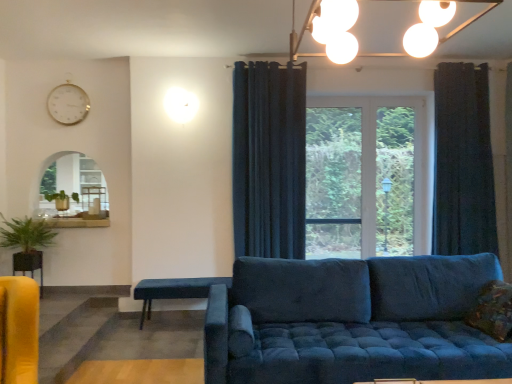
This screenshot has height=384, width=512. What do you see at coordinates (463, 162) in the screenshot?
I see `dark blue textured curtain at right, which appears as the first curtain when viewed from the right` at bounding box center [463, 162].

The width and height of the screenshot is (512, 384). Find the location of `velvet blue studio couch at center`. velvet blue studio couch at center is located at coordinates (351, 321).

Find the location of a particular element. matte white table at left, which is the second table from right to left is located at coordinates (93, 196).

This screenshot has width=512, height=384. In order to click on matte yellow table at lower left, the second table when ordered from front to back in this screenshot , I will do point(29,264).

What is the approximate width of matte yellow table at lower left, acting as the second table starting from the back?

matte yellow table at lower left, acting as the second table starting from the back, is 9.74 inches wide.

Measure the distance between point (x=36, y=237) and camera.

The distance of point (x=36, y=237) from camera is 4.28 meters.

This screenshot has height=384, width=512. I want to click on dark blue textured curtain at right, which ranks as the 2th curtain in left-to-right order, so click(463, 162).

Which is more to the left, white glossy clock at upper left or matte blue bench at center, acting as the first table starting from the bottom?

white glossy clock at upper left is more to the left.

Considering the sizes of objects white glossy clock at upper left and matte blue bench at center, the first table when ordered from front to back, in the image provided, who is bigger, white glossy clock at upper left or matte blue bench at center, the first table when ordered from front to back,?

matte blue bench at center, the first table when ordered from front to back, is bigger.

Between matte white table at left, the 3th table in the bottom-to-top sequence, and green leafy plant at left, which one has larger size?

green leafy plant at left is bigger.

From a real-world perspective, does matte white table at left, which is the second table from right to left, sit lower than green leafy plant at left?

Actually, matte white table at left, which is the second table from right to left, is physically above green leafy plant at left in the real world.

Which of these two, matte white table at left, the third table from the front, or green leafy plant at left, stands taller?

matte white table at left, the third table from the front.

Is matte white table at left, the 1th table when ordered from back to front, aimed at green leafy plant at left?

No, matte white table at left, the 1th table when ordered from back to front, does not turn towards green leafy plant at left.

Who is bigger, matte white table at left, the 1th table from the top, or white glossy clock at upper left?

Bigger between the two is white glossy clock at upper left.

Is point (85, 194) closer or farther from the camera than point (58, 88)?

Point (85, 194) is positioned closer to the camera compared to point (58, 88).

From a real-world perspective, between matte white table at left, the 1th table from the top, and white glossy clock at upper left, who is vertically higher?

In real-world perspective, white glossy clock at upper left is above.

Based on the photo, is matte white table at left, the 1th table when ordered from back to front, next to white glossy clock at upper left?

No, matte white table at left, the 1th table when ordered from back to front, is not next to white glossy clock at upper left.

From the image's perspective, is white glossy clock at upper left under matte yellow table at lower left, the 2th table viewed from the top?

No, from the image's perspective, white glossy clock at upper left is not below matte yellow table at lower left, the 2th table viewed from the top.

Is white glossy clock at upper left at the right side of matte yellow table at lower left, acting as the second table starting from the back?

Indeed, white glossy clock at upper left is positioned on the right side of matte yellow table at lower left, acting as the second table starting from the back.

Which object is closer to the camera, white glossy clock at upper left or matte yellow table at lower left, acting as the second table starting from the back?

matte yellow table at lower left, acting as the second table starting from the back.

From the image's perspective, does white glossy clock at upper left appear higher than dark blue fabric curtain at center, placed as the first curtain when sorted from left to right?

Yes, from the image's perspective, white glossy clock at upper left is above dark blue fabric curtain at center, placed as the first curtain when sorted from left to right.

What's the angular difference between white glossy clock at upper left and dark blue fabric curtain at center, placed as the first curtain when sorted from left to right,'s facing directions?

They differ by 0.454 degrees in their facing directions.

From a real-world perspective, who is located lower, white glossy clock at upper left or dark blue fabric curtain at center, the second curtain positioned from the right?

In real-world perspective, dark blue fabric curtain at center, the second curtain positioned from the right, is lower.

Do you think white glossy clock at upper left is within dark blue fabric curtain at center, placed as the first curtain when sorted from left to right, or outside of it?

white glossy clock at upper left is spatially situated outside dark blue fabric curtain at center, placed as the first curtain when sorted from left to right.

Which is in front, point (362, 260) or point (29, 263)?

Point (362, 260)

Locate an element on the screen. table that is the 2nd one when counting backward from the velvet blue studio couch at center is located at coordinates (29, 264).

Between velvet blue studio couch at center and matte yellow table at lower left, acting as the second table starting from the back, which one appears on the right side from the viewer's perspective?

velvet blue studio couch at center is more to the right.

From a real-world perspective, relative to matte yellow table at lower left, the 1th table viewed from the left, is velvet blue studio couch at center vertically above or below?

velvet blue studio couch at center is below matte yellow table at lower left, the 1th table viewed from the left.

Does matte yellow table at lower left, the second table when ordered from front to back, lie in front of textured brown pillow at lower right?

No, it is behind textured brown pillow at lower right.

Would you consider matte yellow table at lower left, acting as the second table starting from the back, to be distant from textured brown pillow at lower right?

matte yellow table at lower left, acting as the second table starting from the back, is far away from textured brown pillow at lower right.

Between matte yellow table at lower left, which is the third table from right to left, and textured brown pillow at lower right, which one has smaller size?

matte yellow table at lower left, which is the third table from right to left, is smaller.

The width and height of the screenshot is (512, 384). What are the coordinates of `clock lying on the left of matte blue bench at center, placed as the 1th table when sorted from right to left` in the screenshot? It's located at (68, 104).

Locate an element on the screen. The height and width of the screenshot is (384, 512). houseplant that is in front of the matte white table at left, the third table from the front is located at coordinates (26, 235).

Considering their positions, is velvet blue studio couch at center positioned closer to white glossy clock at upper left than dark blue textured curtain at right, which appears as the first curtain when viewed from the right?

velvet blue studio couch at center is closer to white glossy clock at upper left.

Estimate the real-world distances between objects in this image. Which object is closer to velvet blue studio couch at center, dark blue textured curtain at right, which ranks as the 2th curtain in left-to-right order, or white glossy clock at upper left?

dark blue textured curtain at right, which ranks as the 2th curtain in left-to-right order, is positioned closer to the anchor velvet blue studio couch at center.

From the image, which object appears to be nearer to matte white table at left, which is the second table from right to left, matte yellow table at lower left, which is the third table from right to left, or green leafy plant at left?

The object closer to matte white table at left, which is the second table from right to left, is green leafy plant at left.

From the image, which object appears to be nearer to white glossy clock at upper left, dark blue textured curtain at right, which ranks as the 2th curtain in left-to-right order, or matte yellow table at lower left, which appears as the second table when ordered from the bottom?

Based on the image, matte yellow table at lower left, which appears as the second table when ordered from the bottom, appears to be nearer to white glossy clock at upper left.

Looking at the image, which one is located closer to dark blue fabric curtain at center, placed as the first curtain when sorted from left to right, matte yellow table at lower left, the 1th table viewed from the left, or velvet blue studio couch at center?

velvet blue studio couch at center is positioned closer to the anchor dark blue fabric curtain at center, placed as the first curtain when sorted from left to right.

When comparing their distances from matte blue bench at center, which ranks as the third table in left-to-right order, does dark blue fabric curtain at center, the second curtain positioned from the right, or green leafy plant at left seem closer?

dark blue fabric curtain at center, the second curtain positioned from the right.

Estimate the real-world distances between objects in this image. Which object is closer to matte blue bench at center, acting as the first table starting from the bottom, matte yellow table at lower left, acting as the second table starting from the back, or textured brown pillow at lower right?

matte yellow table at lower left, acting as the second table starting from the back, is positioned closer to the anchor matte blue bench at center, acting as the first table starting from the bottom.

Estimate the real-world distances between objects in this image. Which object is closer to white glossy clock at upper left, green leafy plant at left or matte yellow table at lower left, the 1th table viewed from the left?

green leafy plant at left.

Find the location of a particular element. The width and height of the screenshot is (512, 384). curtain between green leafy plant at left and textured brown pillow at lower right is located at coordinates pyautogui.click(x=269, y=160).

Where is `houseplant between matte white table at left, which is counted as the second table, starting from the left, and matte yellow table at lower left, acting as the second table starting from the back, in the up-down direction`? houseplant between matte white table at left, which is counted as the second table, starting from the left, and matte yellow table at lower left, acting as the second table starting from the back, in the up-down direction is located at coordinates (26, 235).

Find the location of a particular element. pillow between matte yellow table at lower left, the second table when ordered from front to back, and dark blue textured curtain at right, which ranks as the 2th curtain in left-to-right order is located at coordinates (493, 311).

You are a GUI agent. You are given a task and a screenshot of the screen. Output one action in this format:
    pyautogui.click(x=<x>, y=<y>)
    Task: Click on the table between green leafy plant at left and matte blue bench at center, which ranks as the third table in left-to-right order, in the horizontal direction
    This screenshot has width=512, height=384.
    Given the screenshot: What is the action you would take?
    pyautogui.click(x=93, y=196)